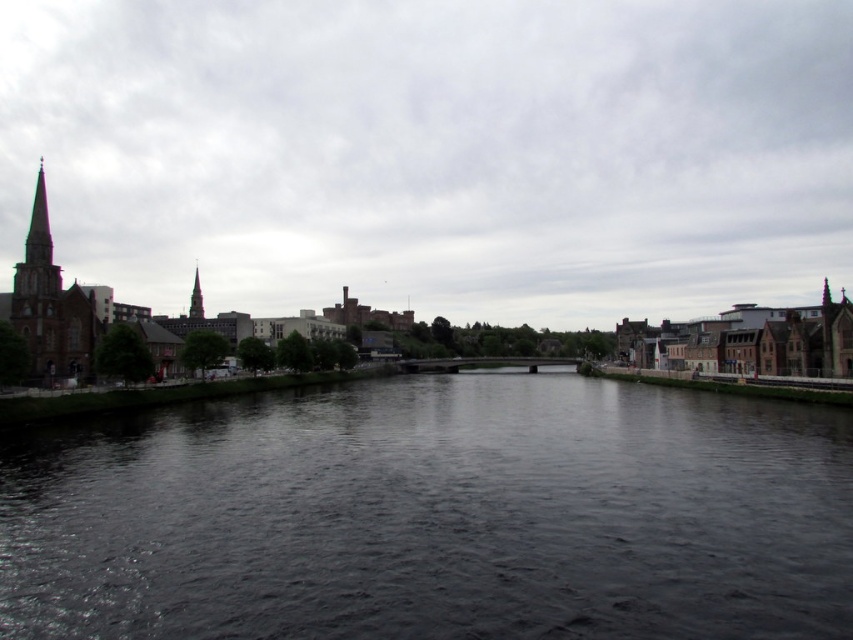
Question: Which point is farther from the camera taking this photo?

Choices:
 (A) (294, 456)
 (B) (200, 304)

Answer: (B)

Question: Is cloudy sky at upper center further to camera compared to dark water at center?

Choices:
 (A) yes
 (B) no

Answer: (A)

Question: Is dark water at center above smooth gray spire at center-left?

Choices:
 (A) yes
 (B) no

Answer: (B)

Question: Which is nearer to the smooth gray spire at center-left?

Choices:
 (A) dark water at center
 (B) cloudy sky at upper center

Answer: (A)

Question: Which object appears closest to the camera in this image?

Choices:
 (A) cloudy sky at upper center
 (B) dark water at center

Answer: (B)

Question: Is dark water at center to the right of smooth gray spire at center-left from the viewer's perspective?

Choices:
 (A) no
 (B) yes

Answer: (B)